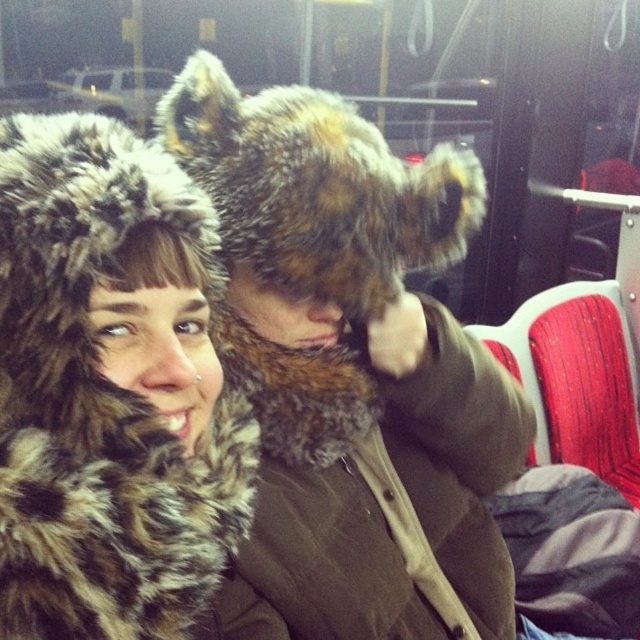
Which is more to the left, fuzzy brown fur hat at center or fuzzy fur hat at upper left?

Positioned to the left is fuzzy fur hat at upper left.

Between point (461, 547) and point (19, 157), which one is positioned behind?

The point (461, 547) is behind.

Is point (340, 513) positioned behind point (80, 598)?

Yes, point (340, 513) is behind point (80, 598).

In order to click on fuzzy brown fur hat at center in this screenshot , I will do `click(352, 371)`.